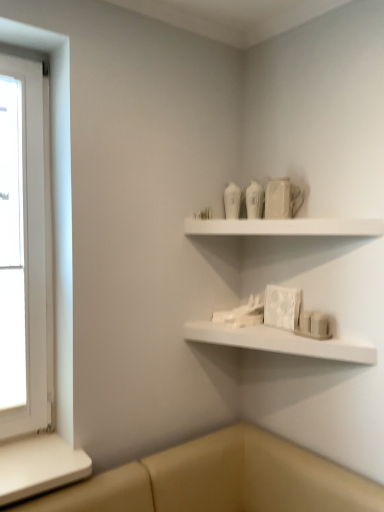
Locate an element on the screen. vacant area on top of white wooden window at left (from a real-world perspective) is located at coordinates (24, 53).